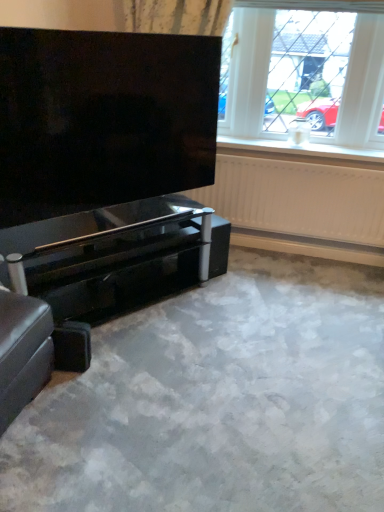
Question: Is glossy black piano at lower left oriented away from white plastic window sill at upper center?

Choices:
 (A) no
 (B) yes

Answer: (A)

Question: From a real-world perspective, does glossy black piano at lower left sit lower than white plastic window sill at upper center?

Choices:
 (A) yes
 (B) no

Answer: (A)

Question: Can you confirm if glossy black piano at lower left is shorter than white plastic window sill at upper center?

Choices:
 (A) yes
 (B) no

Answer: (B)

Question: Is glossy black piano at lower left touching white plastic window sill at upper center?

Choices:
 (A) yes
 (B) no

Answer: (B)

Question: Considering the relative sizes of glossy black piano at lower left and white plastic window sill at upper center in the image provided, is glossy black piano at lower left thinner than white plastic window sill at upper center?

Choices:
 (A) yes
 (B) no

Answer: (B)

Question: Is glossy black piano at lower left aimed at white plastic window sill at upper center?

Choices:
 (A) yes
 (B) no

Answer: (B)

Question: Does leather ottoman at lower left have a greater height compared to white plastic window sill at upper center?

Choices:
 (A) no
 (B) yes

Answer: (B)

Question: Is leather ottoman at lower left further to camera compared to white plastic window sill at upper center?

Choices:
 (A) no
 (B) yes

Answer: (A)

Question: Is leather ottoman at lower left oriented away from white plastic window sill at upper center?

Choices:
 (A) no
 (B) yes

Answer: (A)

Question: From the image's perspective, is leather ottoman at lower left above white plastic window sill at upper center?

Choices:
 (A) yes
 (B) no

Answer: (B)

Question: Is leather ottoman at lower left at the left side of white plastic window sill at upper center?

Choices:
 (A) yes
 (B) no

Answer: (A)

Question: Is leather ottoman at lower left at the right side of white plastic window sill at upper center?

Choices:
 (A) no
 (B) yes

Answer: (A)

Question: From the image's perspective, is white plastic window sill at upper center beneath leather ottoman at lower left?

Choices:
 (A) yes
 (B) no

Answer: (B)